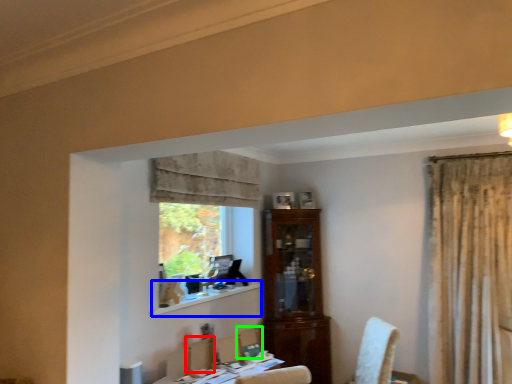
Question: Which is farther away from armchair (highlighted by a red box)? window sill (highlighted by a blue box) or chair (highlighted by a green box)?

Choices:
 (A) window sill
 (B) chair

Answer: (A)